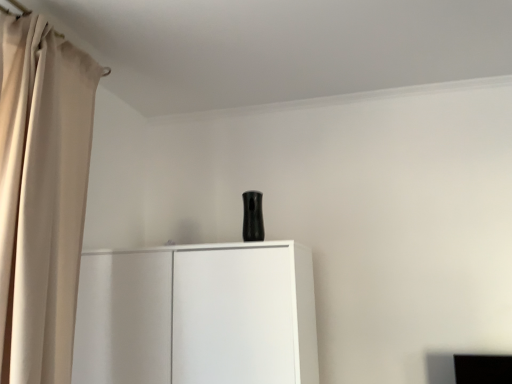
Question: Is the position of beige fabric curtain at left less distant than that of white matte cupboard at center?

Choices:
 (A) yes
 (B) no

Answer: (A)

Question: Is beige fabric curtain at left at the right side of white matte cupboard at center?

Choices:
 (A) yes
 (B) no

Answer: (B)

Question: From a real-world perspective, is beige fabric curtain at left on white matte cupboard at center?

Choices:
 (A) no
 (B) yes

Answer: (B)

Question: Is beige fabric curtain at left oriented away from white matte cupboard at center?

Choices:
 (A) yes
 (B) no

Answer: (B)

Question: Is white matte cupboard at center located within beige fabric curtain at left?

Choices:
 (A) no
 (B) yes

Answer: (A)

Question: Does beige fabric curtain at left have a greater height compared to white matte cupboard at center?

Choices:
 (A) yes
 (B) no

Answer: (A)

Question: Can you confirm if white matte cupboard at center is positioned to the right of beige fabric curtain at left?

Choices:
 (A) no
 (B) yes

Answer: (B)

Question: Does white matte cupboard at center touch beige fabric curtain at left?

Choices:
 (A) no
 (B) yes

Answer: (A)

Question: Can you confirm if white matte cupboard at center is shorter than beige fabric curtain at left?

Choices:
 (A) yes
 (B) no

Answer: (A)

Question: Is white matte cupboard at center wider than beige fabric curtain at left?

Choices:
 (A) yes
 (B) no

Answer: (A)

Question: Could you tell me if white matte cupboard at center is turned towards beige fabric curtain at left?

Choices:
 (A) no
 (B) yes

Answer: (A)

Question: Is beige fabric curtain at left surrounded by white matte cupboard at center?

Choices:
 (A) no
 (B) yes

Answer: (A)

Question: Would you say white matte cupboard at center is to the left or to the right of beige fabric curtain at left in the picture?

Choices:
 (A) right
 (B) left

Answer: (A)